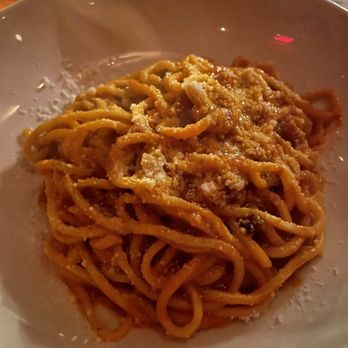
This screenshot has height=348, width=348. In order to click on light brown wood table in this screenshot , I will do `click(2, 3)`.